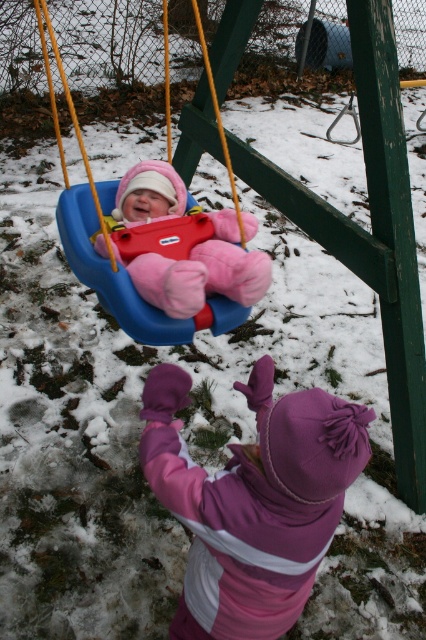
You are designing a new playground safety barrier that needs to be placed around the pink fleece baby at center and the blue plastic swing at center. According to safety regulations, the barrier must be at least 1 meter wider than the widest object. Can you determine if the barrier meets the requirement?

The pink fleece baby at center might be wider than blue plastic swing at center, so the barrier needs to be at least 1 meter wider than the width of the pink fleece baby at center to comply with safety regulations.

You are a parent at the playground and want to ensure the purple fleece mittens at lower center are safe from the cold snow. Since the blue plastic swing at center is above them, will the swing protect the mittens from getting snow on them?

The purple fleece mittens at lower center are positioned under the blue plastic swing at center, so the swing may provide some shelter from snow falling directly on them.